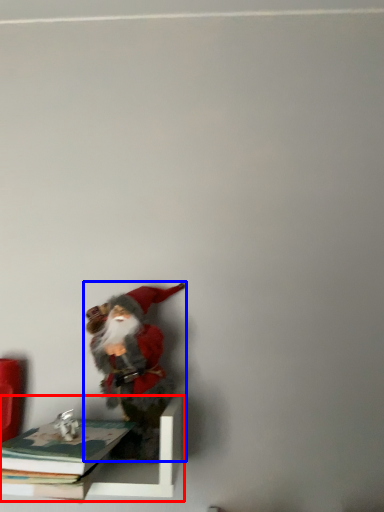
Question: Among these objects, which one is farthest to the camera, shelf (highlighted by a red box) or person (highlighted by a blue box)?

Choices:
 (A) shelf
 (B) person

Answer: (B)